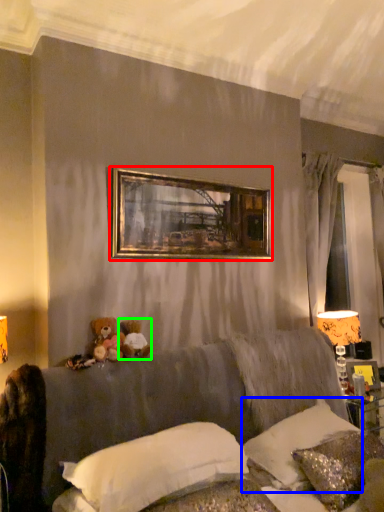
Question: Which is nearer to the picture frame (highlighted by a red box)? pillow (highlighted by a blue box) or toy (highlighted by a green box).

Choices:
 (A) pillow
 (B) toy

Answer: (B)